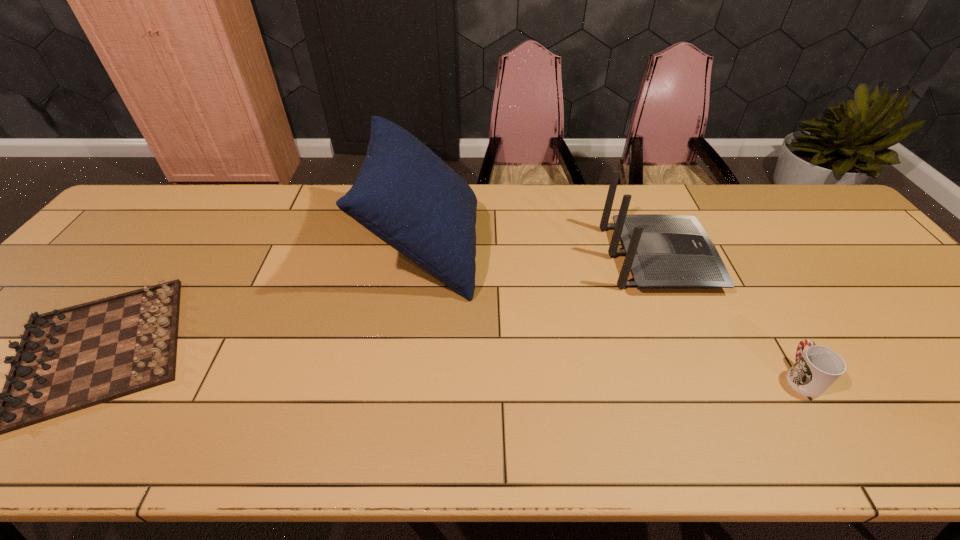
You are a GUI agent. You are given a task and a screenshot of the screen. Output one action in this format:
    pyautogui.click(x=<x>, y=<y>)
    Task: Click on the cushion that is at the far edge
    The width and height of the screenshot is (960, 540).
    Given the screenshot: What is the action you would take?
    pyautogui.click(x=407, y=196)

Where is `router that is at the far edge`? This screenshot has width=960, height=540. router that is at the far edge is located at coordinates (662, 251).

Find the location of a particular element. The height and width of the screenshot is (540, 960). free space at the far edge is located at coordinates (541, 210).

The width and height of the screenshot is (960, 540). Identify the location of free region at the near edge of the desktop. (906, 427).

Image resolution: width=960 pixels, height=540 pixels. What are the coordinates of `vacant space at the right edge` in the screenshot? It's located at (893, 275).

This screenshot has height=540, width=960. Find the location of `vacant region between the second object from right to left and the tallest object`. vacant region between the second object from right to left and the tallest object is located at coordinates (542, 253).

Locate an element on the screen. vacant point located between the rightmost object and the third shortest object is located at coordinates (730, 317).

Locate an element on the screen. The image size is (960, 540). free space that is in between the cushion and the cup is located at coordinates (613, 312).

Locate an element on the screen. free point between the router and the cushion is located at coordinates (542, 253).

Choose which object is the third nearest neighbor to the cushion. Please provide its 2D coordinates. Your answer should be formatted as a tuple, i.e. [(x, y)], where the tuple contains the x and y coordinates of a point satisfying the conditions above.

[(815, 370)]